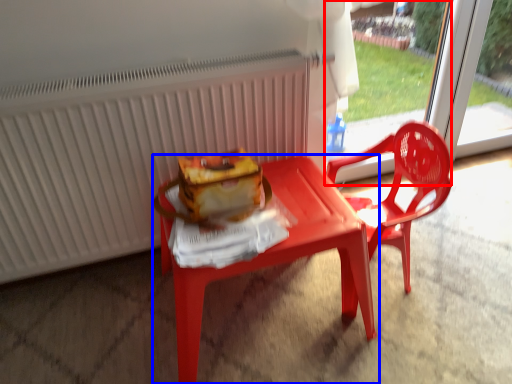
Question: Which of the following is the farthest to the observer, screen door (highlighted by a red box) or table (highlighted by a blue box)?

Choices:
 (A) screen door
 (B) table

Answer: (A)